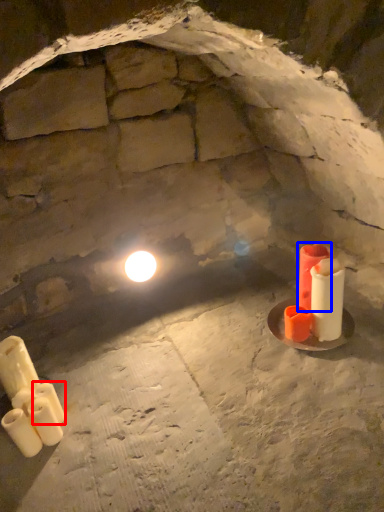
Question: Which point is further to the camera, candle (highlighted by a red box) or candle (highlighted by a blue box)?

Choices:
 (A) candle
 (B) candle

Answer: (B)